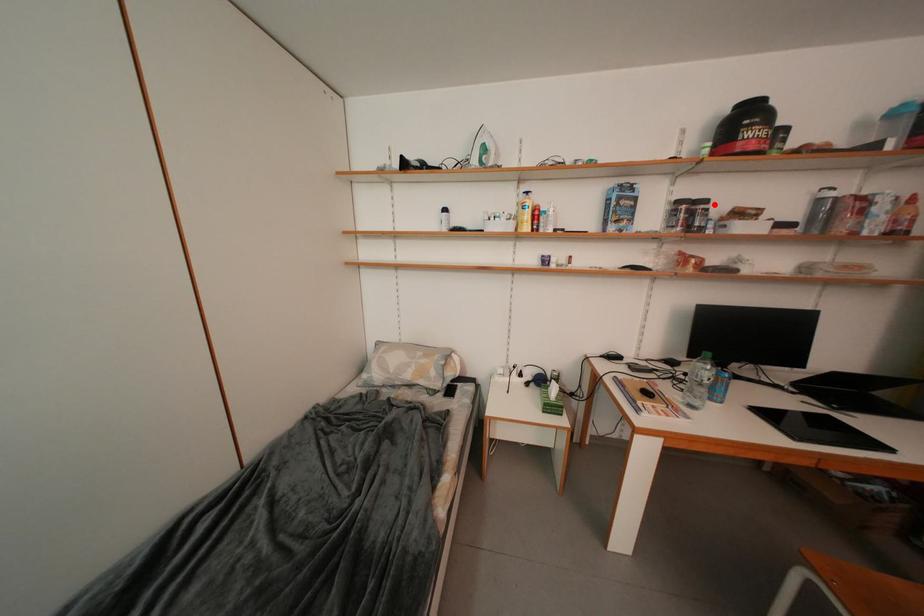
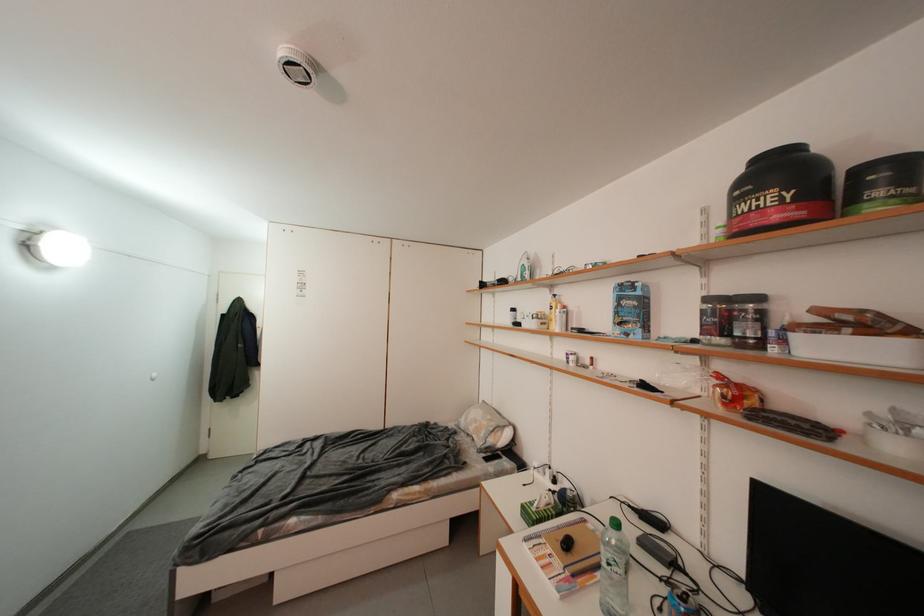
Find the pixel in the second image that matches the highlighted location in the first image.

(766, 301)